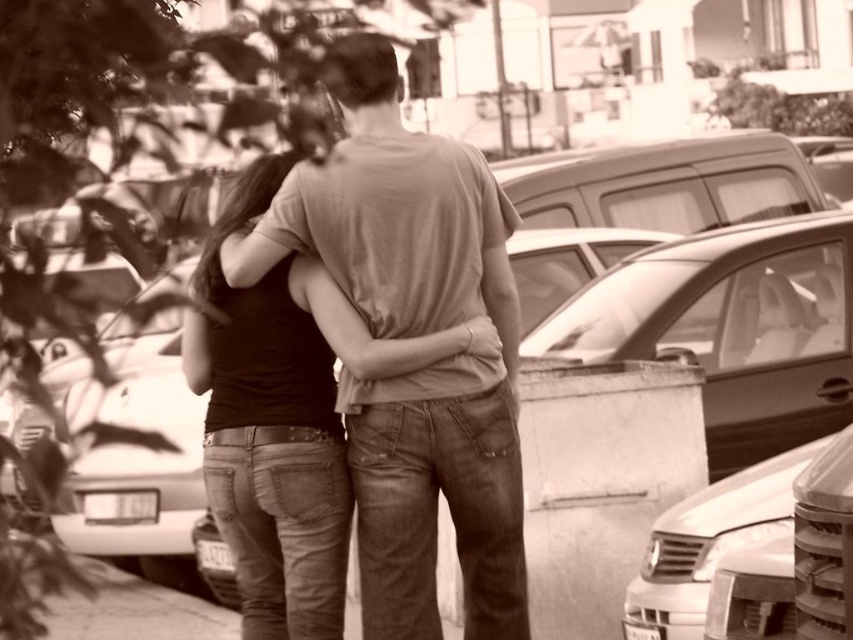
You are a photographer trying to capture a photo of the two people in the scene. The black matte tank top at center and the metallic silver car at lower right are both in your viewfinder. Based on their positions, which object appears larger in the photo?

The black matte tank top at center appears larger in the photo because it is taller than the metallic silver car at lower right.

Looking at this image, you are a photographer standing at the camera position. You want to take a photo of both the matte brown shirt at center and the metallic silver car at lower right. Can you fit both into the frame without moving your position? Explain why or why not using their distance.

The matte brown shirt at center is 1.57 meters away from the metallic silver car at lower right. Since the distance between them is relatively small, it is likely possible to capture both in a single frame without moving the camera position, provided the camera has a wide enough lens to encompass both subjects at that distance.